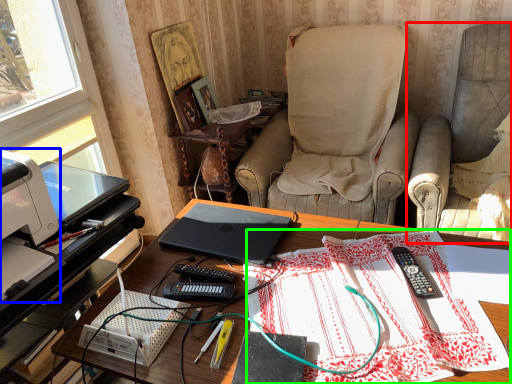
Question: Considering the real-world distances, which object is farthest from chair (highlighted by a red box)? printer (highlighted by a blue box) or tablecloth (highlighted by a green box)?

Choices:
 (A) printer
 (B) tablecloth

Answer: (A)